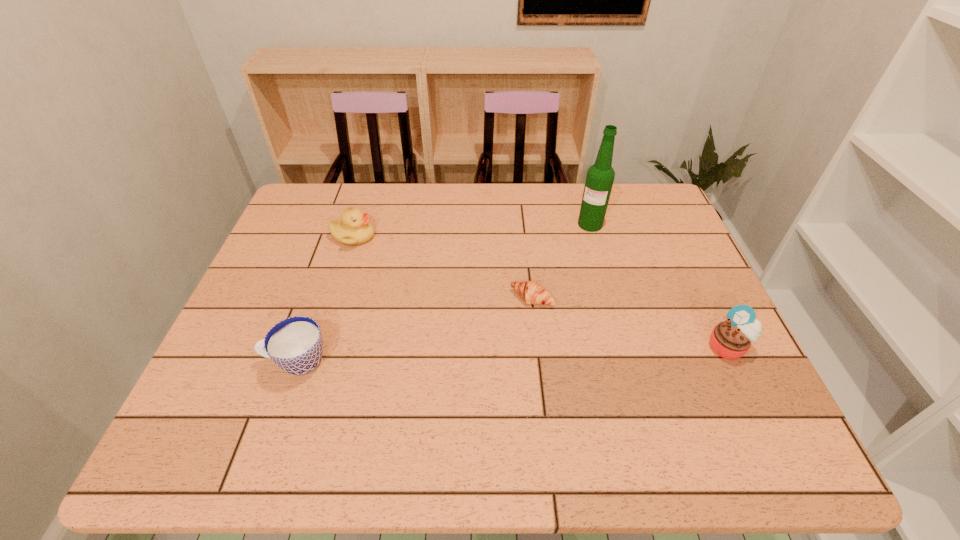
The image size is (960, 540). Find the location of `cup`. cup is located at coordinates (295, 344).

Where is `the rightmost object`? This screenshot has width=960, height=540. the rightmost object is located at coordinates (731, 339).

You are a GUI agent. You are given a task and a screenshot of the screen. Output one action in this format:
    pyautogui.click(x=<x>, y=<y>)
    Task: Click on the fourth shortest object
    This screenshot has height=540, width=960.
    Given the screenshot: What is the action you would take?
    pyautogui.click(x=731, y=339)

At what (x,y) coordinates should I click in order to perform the action: click on the tallest object. Please return your answer as a coordinate pair (x, y). Looking at the image, I should click on (600, 176).

I want to click on beer bottle, so click(x=600, y=176).

Locate an element on the screen. This screenshot has width=960, height=540. the shortest object is located at coordinates (531, 292).

The image size is (960, 540). I want to click on the third farthest object, so click(x=531, y=292).

Image resolution: width=960 pixels, height=540 pixels. What are the coordinates of `duckling` in the screenshot? It's located at click(x=355, y=228).

Find the location of a particular element. The image size is (960, 540). free space located 0.070m on the side of the cup with the handle is located at coordinates (231, 362).

Image resolution: width=960 pixels, height=540 pixels. What are the coordinates of `vacant area situated 0.080m on the side of the cup with the handle` in the screenshot? It's located at (228, 362).